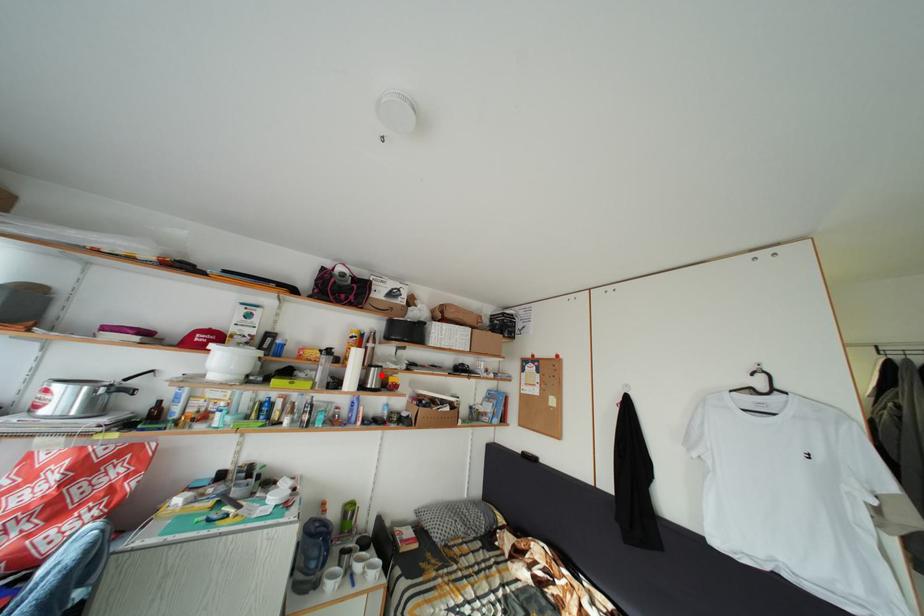
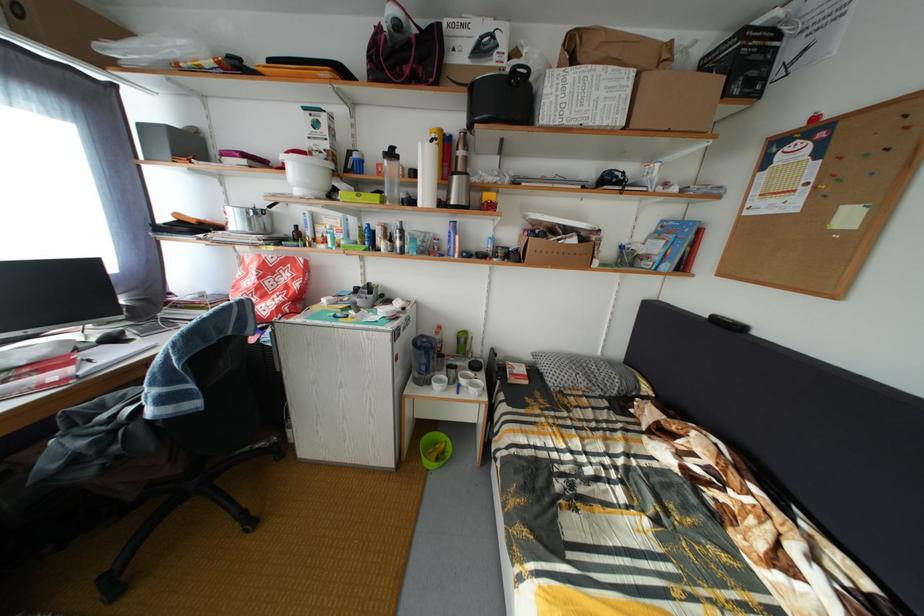
The point at the highlighted location is marked in the first image. Where is the corresponding point in the second image?

(464, 184)